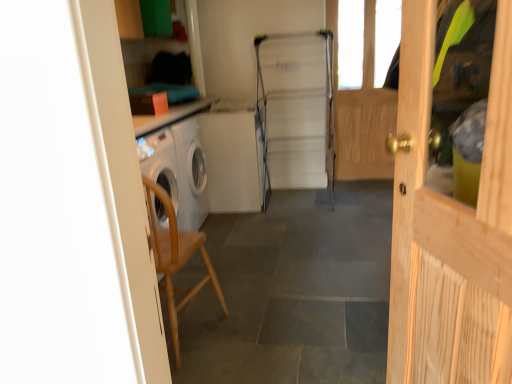
Identify the location of wooden chair at left. (295, 292).

This screenshot has height=384, width=512. Describe the element at coordinates (176, 258) in the screenshot. I see `wooden chair at left` at that location.

I want to click on wooden chair at left, so click(295, 292).

Is wooden chair at left closer to the viewer compared to light wood door at right?

No, wooden chair at left is further to the viewer.

Considering the relative sizes of wooden chair at left and light wood door at right in the image provided, is wooden chair at left bigger than light wood door at right?

Indeed, wooden chair at left has a larger size compared to light wood door at right.

From the picture: From the image's perspective, between wooden chair at left and light wood door at right, who is located below?

wooden chair at left, from the image's perspective.

From a real-world perspective, relative to light wood door at right, is wooden chair at left vertically above or below?

wooden chair at left is below light wood door at right.

Between point (258, 101) and point (344, 247), which one is positioned in front?

The point (344, 247) is closer to the camera.

Is metallic silver fridge at center not close to wooden chair at left?

That's right, there is a large distance between metallic silver fridge at center and wooden chair at left.

Considering the relative sizes of metallic silver fridge at center and wooden chair at left in the image provided, is metallic silver fridge at center smaller than wooden chair at left?

Incorrect, metallic silver fridge at center is not smaller in size than wooden chair at left.

Is wooden screen door at right turned away from wooden chair at left?

No.

Is point (354, 155) farther from viewer compared to point (211, 218)?

That is True.

Consider the image. Is wooden chair at left located within wooden screen door at right?

No, wooden chair at left is not a part of wooden screen door at right.

Where is `screen door behind the wooden chair at left`? screen door behind the wooden chair at left is located at coordinates (362, 110).

Which is behind, point (226, 327) or point (463, 335)?

The point (226, 327) is more distant.

Locate an element on the screen. concrete on the left of light wood door at right is located at coordinates (295, 292).

From a real-world perspective, between wooden chair at left and light wood door at right, who is vertically higher?

In real-world perspective, light wood door at right is above.

In the scene shown: Can you confirm if light wood door at right is smaller than wooden chair at left?

Correct, light wood door at right occupies less space than wooden chair at left.

Is light wood door at right looking in the opposite direction of wooden chair at left?

light wood door at right does not have its back to wooden chair at left.

From a real-world perspective, who is located lower, light wood door at right or wooden chair at left?

wooden chair at left is physically lower.

Is wooden chair at left surrounding wooden chair at left?

That's incorrect, wooden chair at left is not inside wooden chair at left.

Can you tell me how much wooden chair at left and wooden chair at left differ in facing direction?

The facing directions of wooden chair at left and wooden chair at left are 178 degrees apart.

From the image's perspective, relative to wooden chair at left, is wooden chair at left above or below?

wooden chair at left is situated lower than wooden chair at left in the image.

Which of these two, wooden chair at left or wooden chair at left, is smaller?

Smaller between the two is wooden chair at left.

Is wooden screen door at right thinner than light wood door at right?

Yes, wooden screen door at right is thinner than light wood door at right.

Considering the points (368, 151) and (497, 312), which point is in front, point (368, 151) or point (497, 312)?

The point (497, 312) is closer to the camera.

Is wooden screen door at right to the right of light wood door at right from the viewer's perspective?

Indeed, wooden screen door at right is positioned on the right side of light wood door at right.

This screenshot has height=384, width=512. I want to click on chair lying below the light wood door at right (from the image's perspective), so click(x=176, y=258).

Locate an element on the screen. The height and width of the screenshot is (384, 512). fridge located on the right of wooden chair at left is located at coordinates (297, 108).

In the scene shown: Looking at the image, which one is located further to wooden chair at left, wooden screen door at right or light wood door at right?

wooden screen door at right is positioned further to the anchor wooden chair at left.

Estimate the real-world distances between objects in this image. Which object is further from wooden chair at left, wooden screen door at right or metallic silver fridge at center?

Among the two, wooden screen door at right is located further to wooden chair at left.

From the image, which object appears to be farther from wooden screen door at right, metallic silver fridge at center or wooden chair at left?

wooden chair at left.

Which object lies nearer to the anchor point metallic silver fridge at center, wooden chair at left or wooden screen door at right?

The object closer to metallic silver fridge at center is wooden screen door at right.

Considering their positions, is metallic silver fridge at center positioned closer to wooden chair at left than wooden chair at left?

wooden chair at left.

From the image, which object appears to be farther from wooden screen door at right, light wood door at right or wooden chair at left?

light wood door at right.

Consider the image. Looking at the image, which one is located further to wooden chair at left, light wood door at right or wooden chair at left?

Among the two, light wood door at right is located further to wooden chair at left.

When comparing their distances from wooden chair at left, does metallic silver fridge at center or light wood door at right seem further?

metallic silver fridge at center.

This screenshot has height=384, width=512. Find the location of `fridge located between wooden chair at left and wooden screen door at right in the depth direction`. fridge located between wooden chair at left and wooden screen door at right in the depth direction is located at coordinates (297, 108).

The width and height of the screenshot is (512, 384). In order to click on fridge between wooden chair at left and wooden screen door at right along the z-axis in this screenshot , I will do `click(297, 108)`.

Where is `chair positioned between wooden chair at left and wooden screen door at right from near to far`? Image resolution: width=512 pixels, height=384 pixels. chair positioned between wooden chair at left and wooden screen door at right from near to far is located at coordinates (176, 258).

Where is `chair positioned between light wood door at right and metallic silver fridge at center from near to far`? chair positioned between light wood door at right and metallic silver fridge at center from near to far is located at coordinates point(176,258).